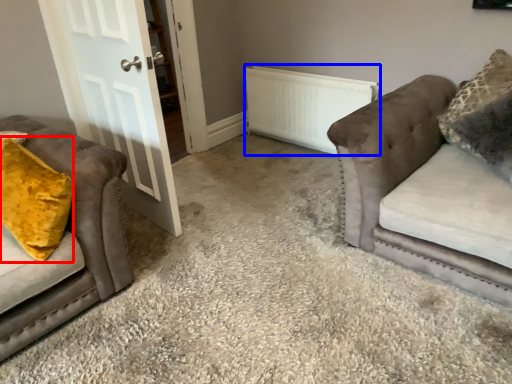
Question: Which of the following is the closest to the observer, throw pillow (highlighted by a red box) or radiator (highlighted by a blue box)?

Choices:
 (A) throw pillow
 (B) radiator

Answer: (A)